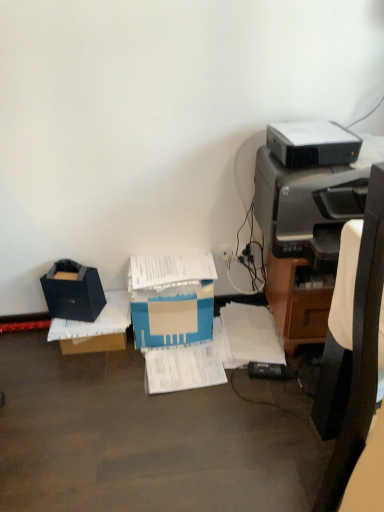
Question: Is there a large distance between black plastic chair at right and blue cardboard box at center?

Choices:
 (A) yes
 (B) no

Answer: (B)

Question: Is black plastic chair at right turned away from blue cardboard box at center?

Choices:
 (A) yes
 (B) no

Answer: (B)

Question: Is black plastic chair at right with blue cardboard box at center?

Choices:
 (A) yes
 (B) no

Answer: (B)

Question: Could blue cardboard box at center be considered to be inside black plastic chair at right?

Choices:
 (A) no
 (B) yes

Answer: (A)

Question: Is black plastic chair at right facing towards blue cardboard box at center?

Choices:
 (A) no
 (B) yes

Answer: (A)

Question: From a real-world perspective, is white paper at lower right, positioned as the first document in right-to-left order, physically located above or below black plastic printer at upper right, placed as the first printer when sorted from top to bottom?

Choices:
 (A) above
 (B) below

Answer: (B)

Question: Is point (231, 331) positioned closer to the camera than point (332, 164)?

Choices:
 (A) farther
 (B) closer

Answer: (A)

Question: Based on their positions, is white paper at lower right, placed as the second document when sorted from left to right, located to the left or right of black plastic printer at upper right, arranged as the 2th printer when ordered from the bottom?

Choices:
 (A) left
 (B) right

Answer: (A)

Question: Based on their sizes in the image, would you say white paper at lower right, positioned as the first document in right-to-left order, is bigger or smaller than black plastic printer at upper right, placed as the first printer when sorted from top to bottom?

Choices:
 (A) small
 (B) big

Answer: (A)

Question: From a real-world perspective, is matte black storage box at left, the 2th storage box positioned from the top, physically located above or below black plastic printer at upper right, arranged as the 2th printer when ordered from the bottom?

Choices:
 (A) above
 (B) below

Answer: (B)

Question: Do you think matte black storage box at left, the 2th storage box positioned from the top, is within black plastic printer at upper right, placed as the first printer when sorted from top to bottom, or outside of it?

Choices:
 (A) outside
 (B) inside

Answer: (A)

Question: Is matte black storage box at left, which is counted as the first storage box, starting from the bottom, bigger or smaller than black plastic printer at upper right, placed as the first printer when sorted from top to bottom?

Choices:
 (A) big
 (B) small

Answer: (A)

Question: Considering the positions of matte black storage box at left, which is counted as the first storage box, starting from the bottom, and black plastic printer at upper right, placed as the first printer when sorted from top to bottom, in the image, is matte black storage box at left, which is counted as the first storage box, starting from the bottom, taller or shorter than black plastic printer at upper right, placed as the first printer when sorted from top to bottom,?

Choices:
 (A) tall
 (B) short

Answer: (A)

Question: In terms of height, does white paper at center, placed as the 1th document when sorted from left to right, look taller or shorter compared to black plastic printer at right, which ranks as the 1th printer in bottom-to-top order?

Choices:
 (A) tall
 (B) short

Answer: (B)

Question: Considering the positions of point (206, 376) and point (342, 215), is point (206, 376) closer or farther from the camera than point (342, 215)?

Choices:
 (A) farther
 (B) closer

Answer: (A)